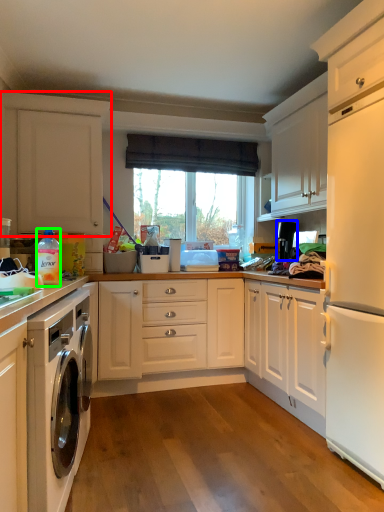
Question: Considering the real-world distances, which object is farthest from cabinetry (highlighted by a red box)? appliance (highlighted by a blue box) or bottle (highlighted by a green box)?

Choices:
 (A) appliance
 (B) bottle

Answer: (A)